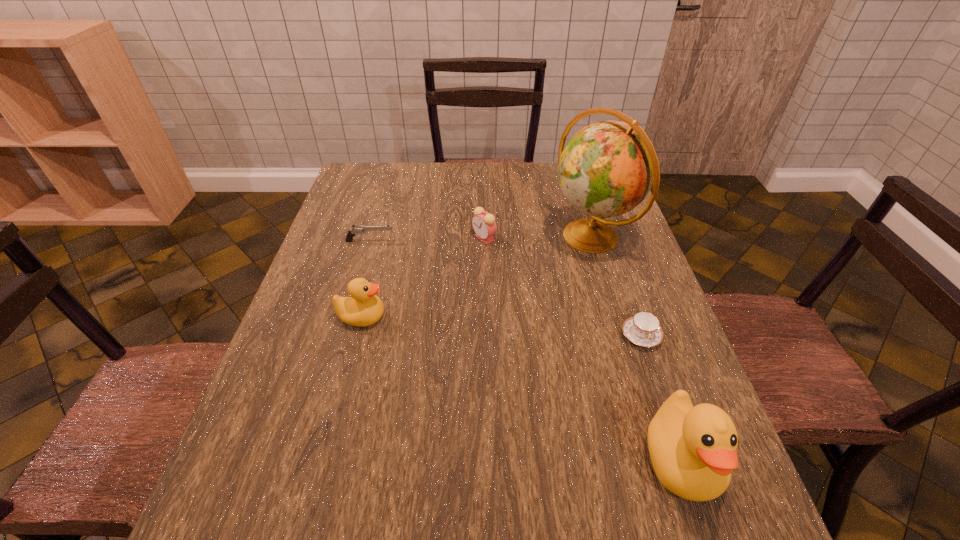
If equal spacing is desired by inserting an extra duck among them, please point out a free spot for this new duck. Please provide its 2D coordinates. Your answer should be formatted as a tuple, i.e. [(x, y)], where the tuple contains the x and y coordinates of a point satisfying the conditions above.

[(499, 379)]